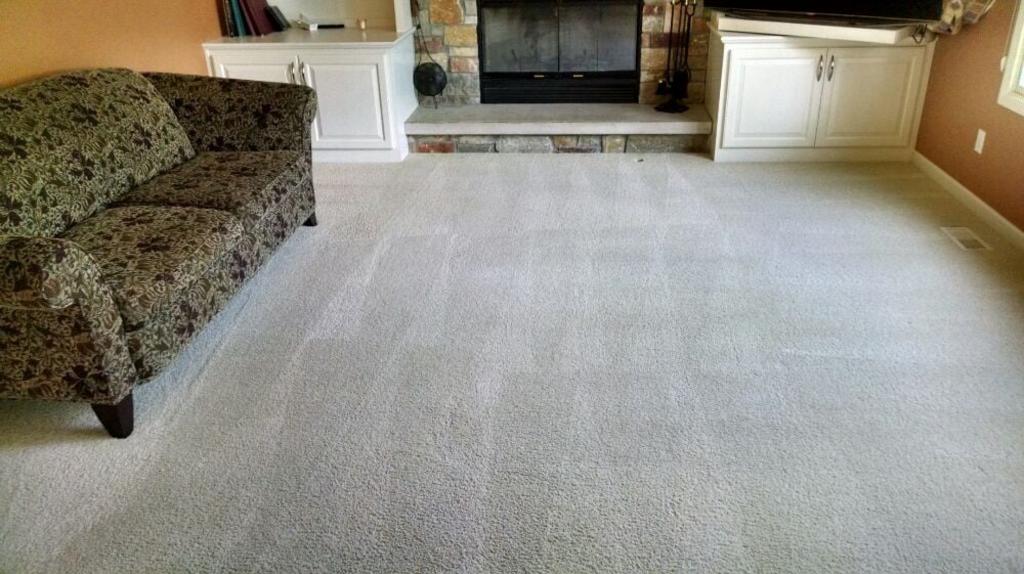
The image size is (1024, 574). I want to click on wall, so click(951, 87).